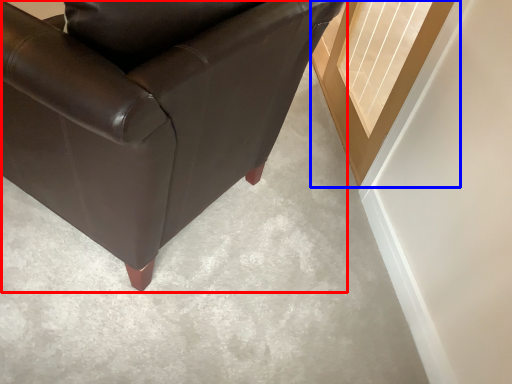
Question: Which object is further to the camera taking this photo, chair (highlighted by a red box) or window (highlighted by a blue box)?

Choices:
 (A) chair
 (B) window

Answer: (B)